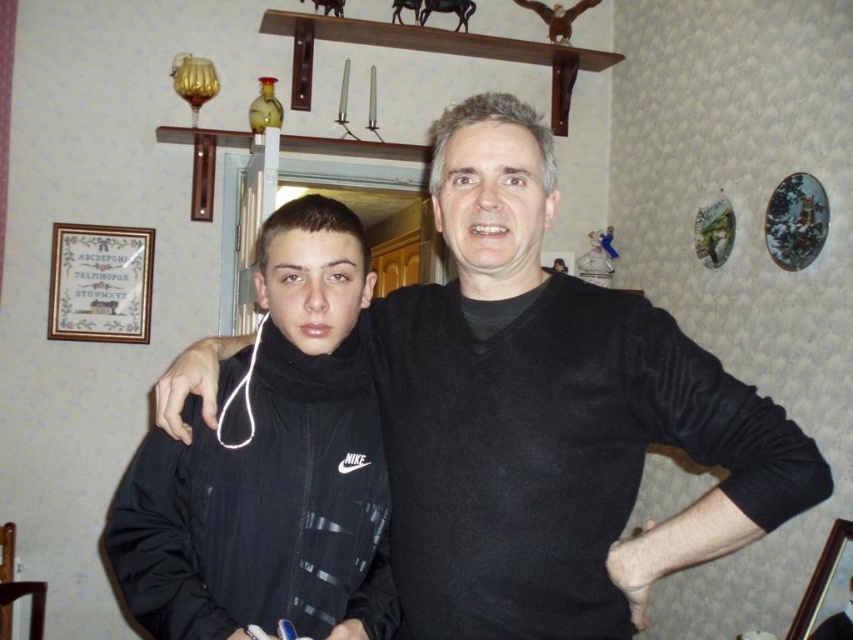
Can you confirm if black matte sweater at center is wider than black matte jacket at center?

Indeed, black matte sweater at center has a greater width compared to black matte jacket at center.

Is point (383, 412) behind point (178, 451)?

Yes, it is.

Locate an element on the screen. black matte sweater at center is located at coordinates (550, 417).